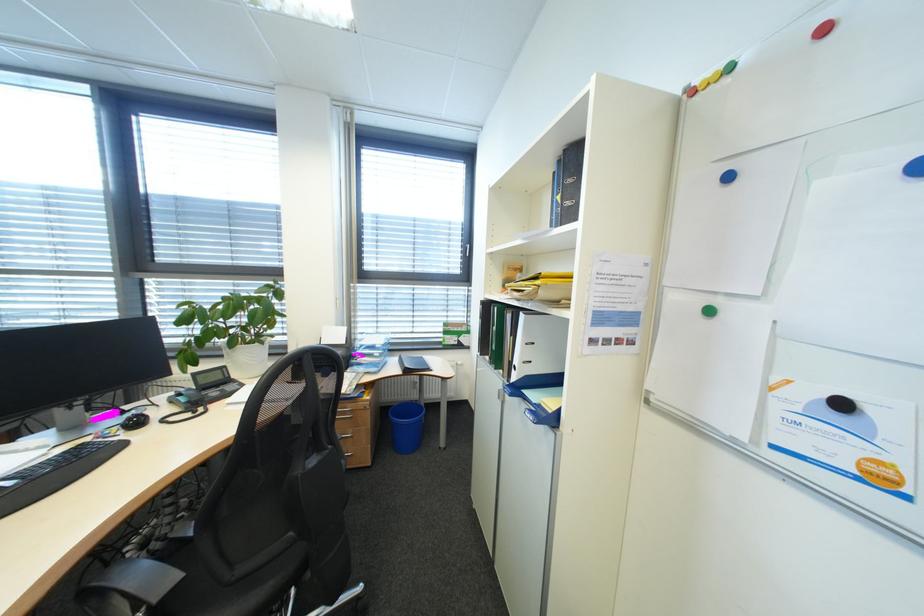
The image size is (924, 616). What do you see at coordinates (468, 249) in the screenshot?
I see `a window handle` at bounding box center [468, 249].